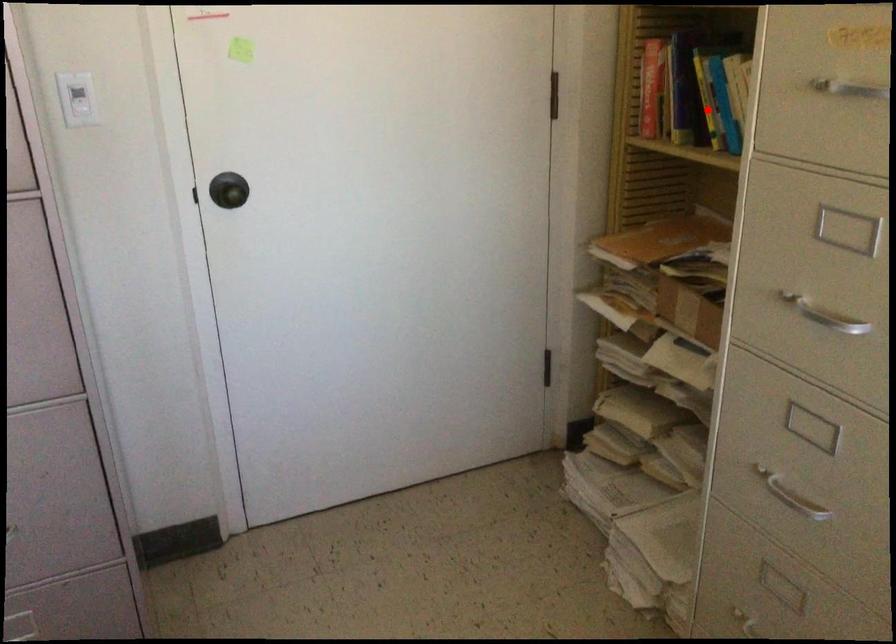
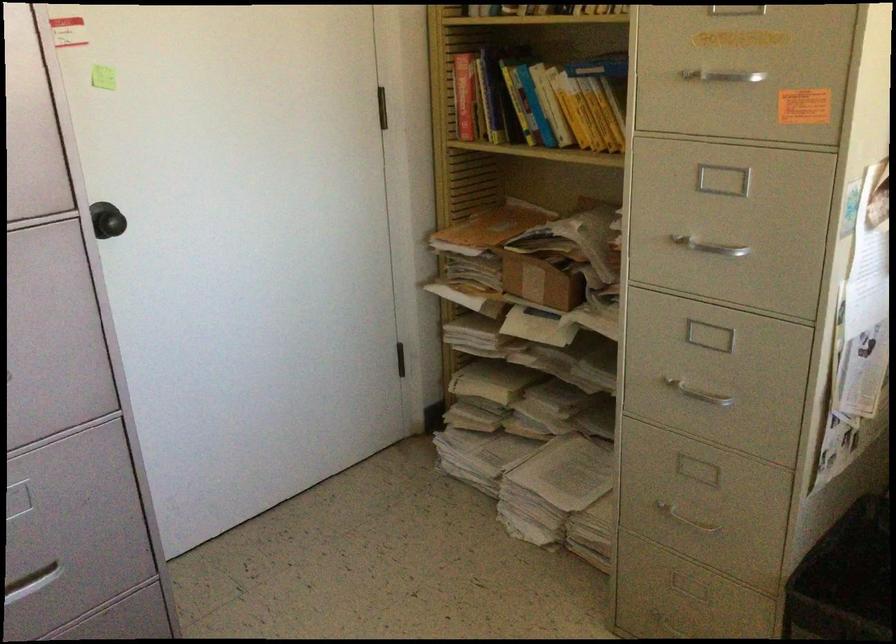
Locate, in the second image, the point that corresponds to the highlighted location in the first image.

(523, 111)